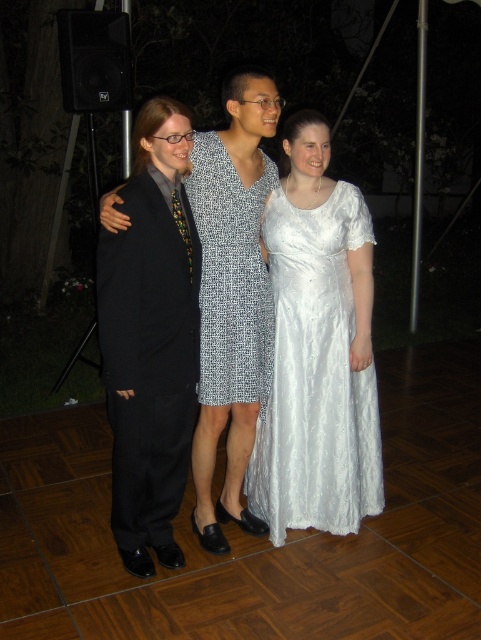
You are a photographer at a formal event and need to capture a photo of the white satin dress at center and the printed fabric dress at center. Based on their positions, which dress is positioned lower in the frame?

The white satin dress at center is below the printed fabric dress at center, so the white satin dress at center is positioned lower in the frame.